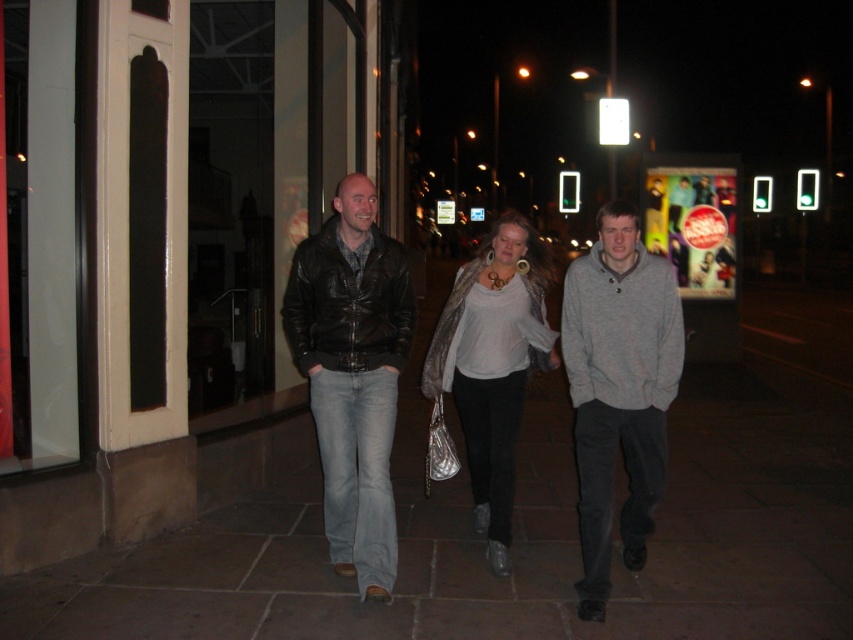
You are a photographer trying to capture a group of people walking on a wet, reflective sidewalk. You notice two individuals wearing a leather jacket at center and a gray cotton hoodie at center. Which person should you focus on if you want to include their reflection in the water on the ground?

The leather jacket at center is positioned on the left side of gray cotton hoodie at center. Since the sidewalk is wet and reflective, focusing on the leather jacket at center would allow you to capture its reflection in the water on the ground as it is positioned closer to the left side where the reflection might be clearer or more prominent due to the wet surface.

You are standing at the origin point of the image coordinate system. You see a leather jacket at center located at point (492, 364). If you want to walk towards the leather jacket at center, which direction should you move?

The leather jacket at center is located at point (492, 364). Since the coordinate system is based on the image, moving towards the point would require adjusting your direction based on your current position relative to the coordinate system. However, without knowing your current coordinates, it is impossible to determine the exact direction to move.